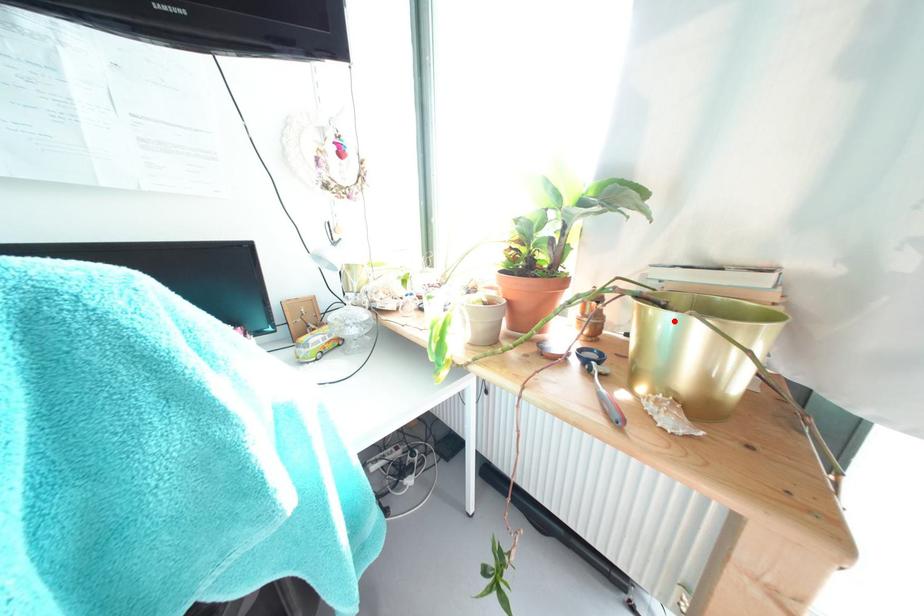
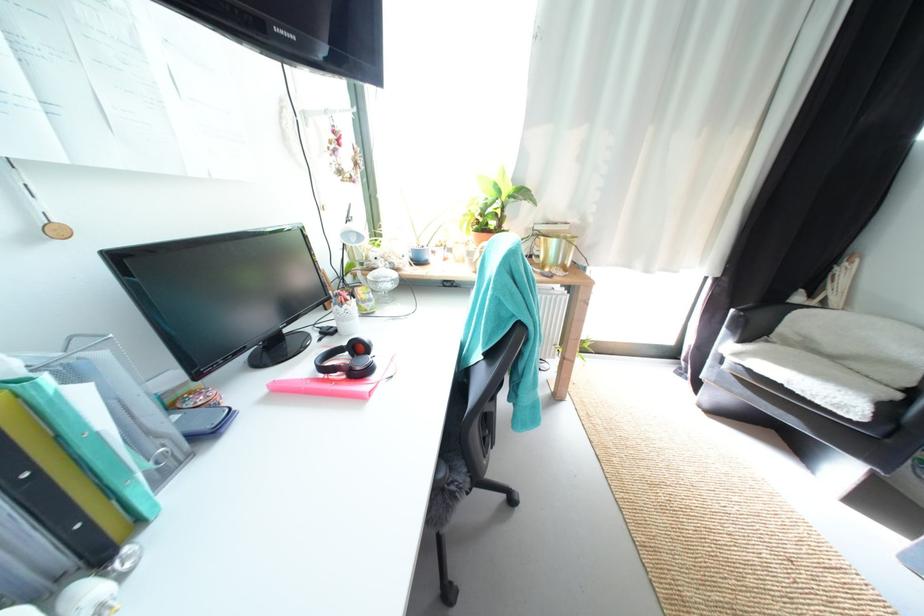
Find the pixel in the second image that matches the highlighted location in the first image.

(562, 244)